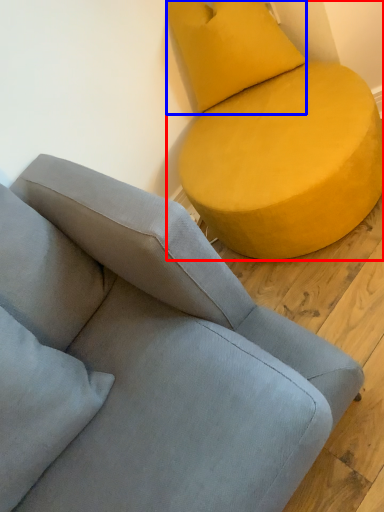
Question: Which object is further to the camera taking this photo, studio couch (highlighted by a red box) or pillow (highlighted by a blue box)?

Choices:
 (A) studio couch
 (B) pillow

Answer: (B)